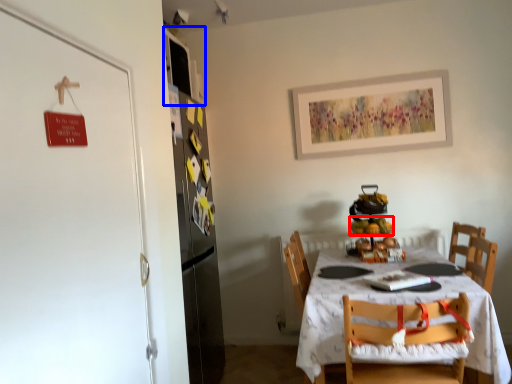
Question: Which of the following is the farthest to the observer, fruit (highlighted by a red box) or cabinetry (highlighted by a blue box)?

Choices:
 (A) fruit
 (B) cabinetry

Answer: (B)